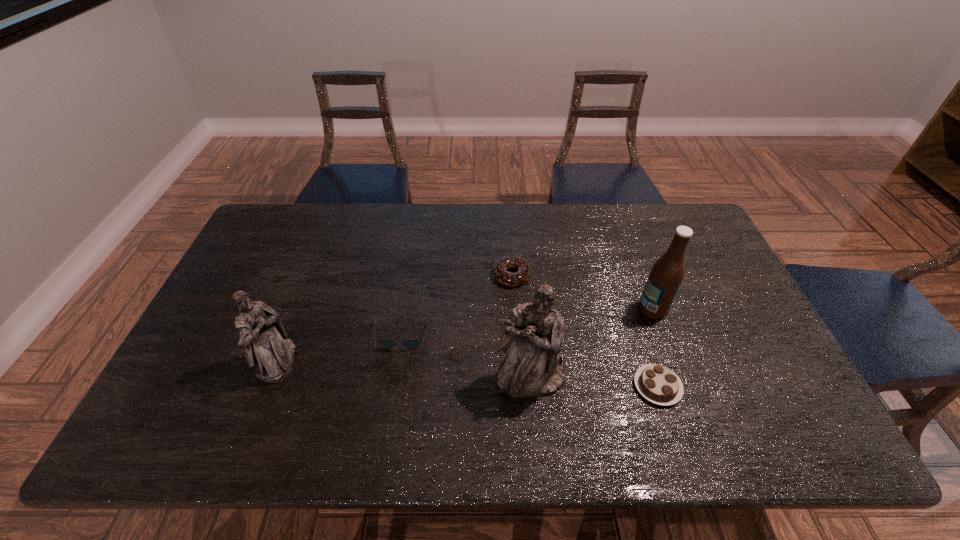
Image resolution: width=960 pixels, height=540 pixels. What are the coordinates of `vacant area in the image that satisfies the following two spatial constraints: 1. on the front-facing side of the chocolate cake; 2. on the right side of the shorter figurine` in the screenshot? It's located at (268, 386).

Identify the location of vacant space that satisfies the following two spatial constraints: 1. on the back side of the chocolate cake; 2. on the left side of the beer bottle. Image resolution: width=960 pixels, height=540 pixels. (633, 309).